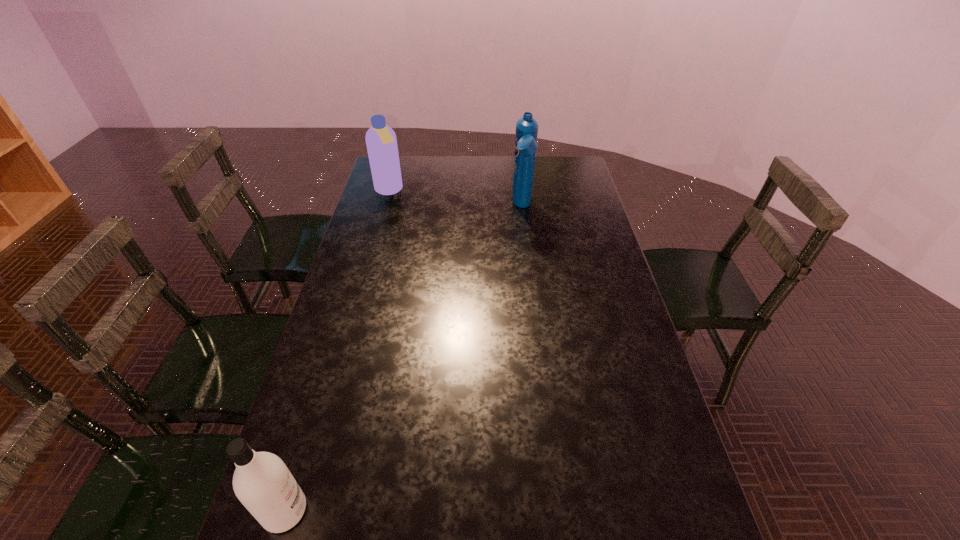
Locate an element on the screen. The width and height of the screenshot is (960, 540). vacant space in between the rightmost shampoo and the nearest object is located at coordinates (404, 359).

Where is `free space between the rightmost shampoo and the nearest shampoo`? This screenshot has width=960, height=540. free space between the rightmost shampoo and the nearest shampoo is located at coordinates (404, 359).

The width and height of the screenshot is (960, 540). I want to click on the second closest object to the nearest object, so click(381, 142).

Identify the location of the second closest object relative to the rightmost object. The width and height of the screenshot is (960, 540). (262, 482).

The image size is (960, 540). I want to click on the closest shampoo to the nearest shampoo, so click(x=526, y=145).

The width and height of the screenshot is (960, 540). Find the location of `shampoo that is the second closest to the rightmost shampoo`. shampoo that is the second closest to the rightmost shampoo is located at coordinates coord(262,482).

The height and width of the screenshot is (540, 960). In order to click on vacant space that satisfies the following two spatial constraints: 1. on the front side of the rightmost object; 2. on the front-facing side of the nearest object in this screenshot , I will do tap(560, 511).